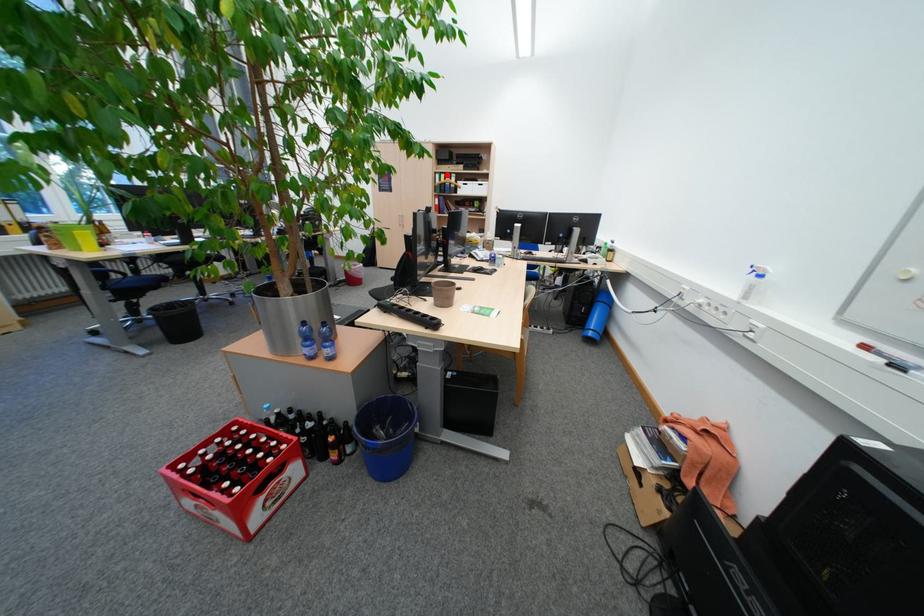
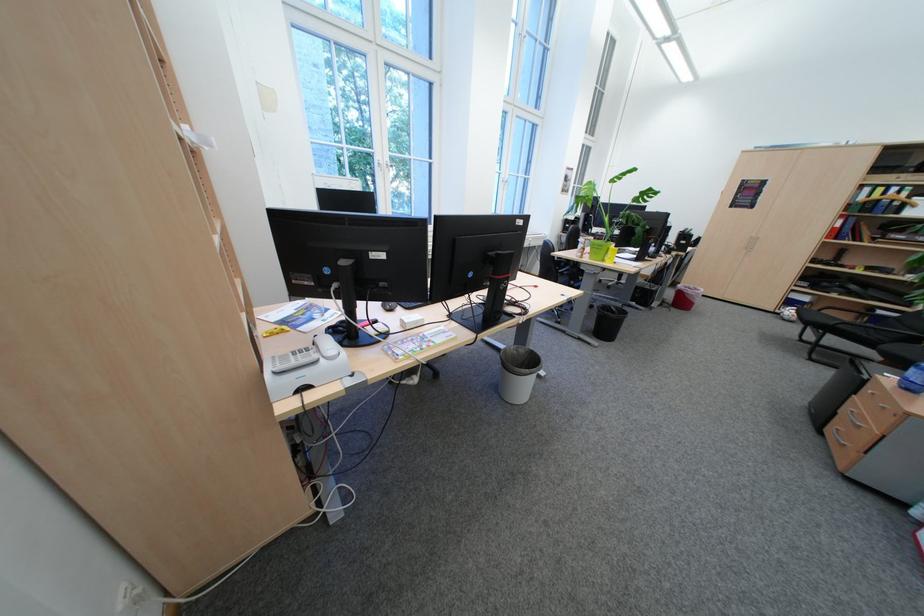
Question: I am providing you with two images of the same scene from different viewpoints. In image1, a red point is highlighted. Considering the same 3D point in image2, which of the following is correct?

Choices:
 (A) It is closer
 (B) It is farther

Answer: (B)